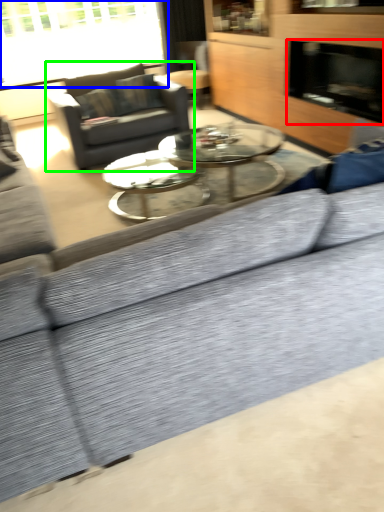
Question: Based on their relative distances, which object is farther from fireplace (highlighted by a red box)? Choose from window (highlighted by a blue box) and studio couch (highlighted by a green box).

Choices:
 (A) window
 (B) studio couch

Answer: (A)